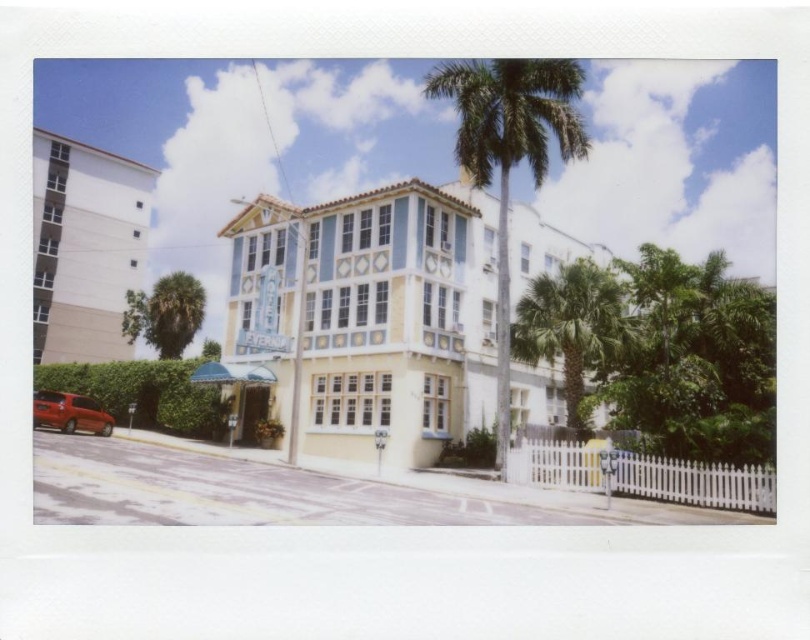
Based on the scene description, where is the white smooth building at left located in the image?

The white smooth building at left is located at point 2D coordinates of (x=84, y=248).

You are standing at the point closest to the building. Which point, point (472, 385) or point (504, 92), is farther away from you?

Point (472, 385) is behind point (504, 92), so it is farther away from you.